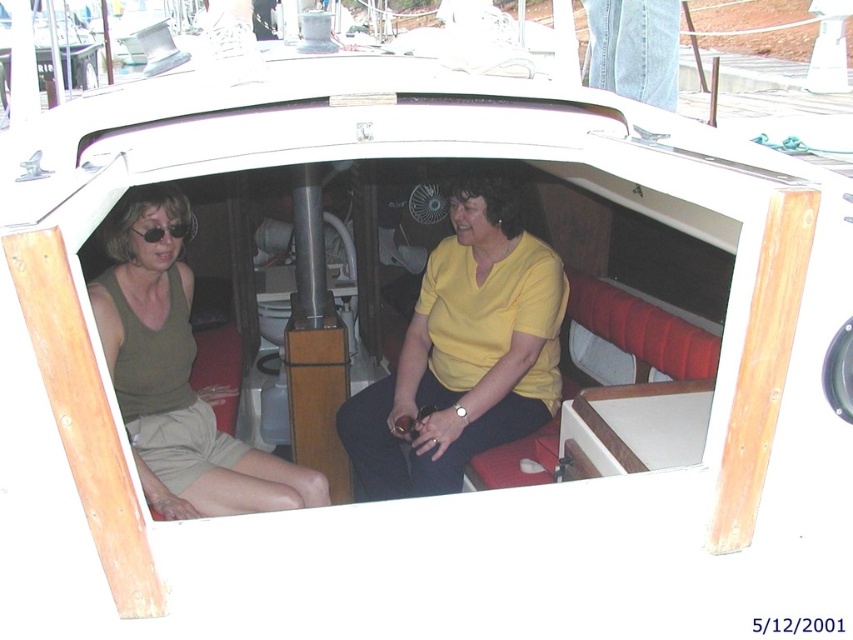
Consider the image. You are a photographer standing in front of the boat cabin. You want to take a photo of both the yellow matte shirt at center and the matte green tank top at left. Which one should you focus on first to ensure both are in clear view?

You should focus on the yellow matte shirt at center first because it is closer to you than the matte green tank top at left, ensuring both are in clear view.